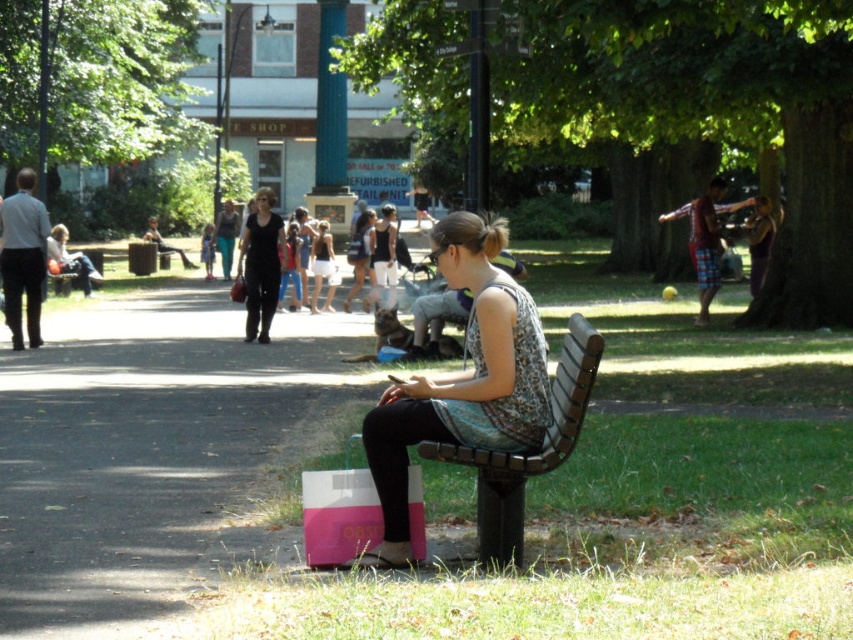
You are a photographer trying to capture the scene of the park. You want to focus on the matte black dress at center. Where should you aim your camera to ensure the dress is in the center of your photo?

You should aim your camera at the coordinates point (260, 264) to ensure the matte black dress at center is centered in your photo.

You are a photographer trying to capture a candid shot of both the matte black dress at center and the white cotton dress at center. Since you want to ensure both are visible in the frame, which dress should you focus on to keep both in focus?

You should focus on the matte black dress at center because it is in front of the white cotton dress at center, so focusing on the front object will help keep both in focus.